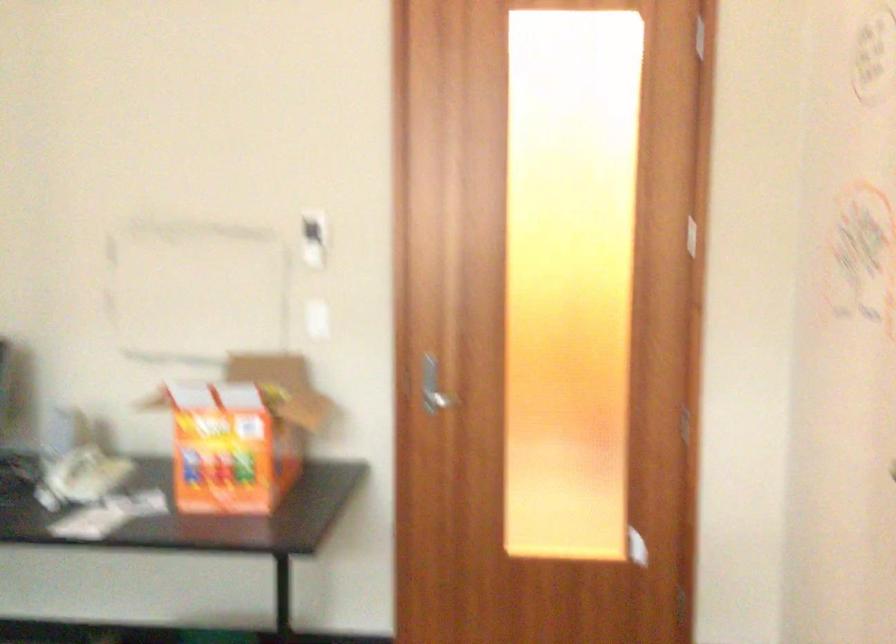
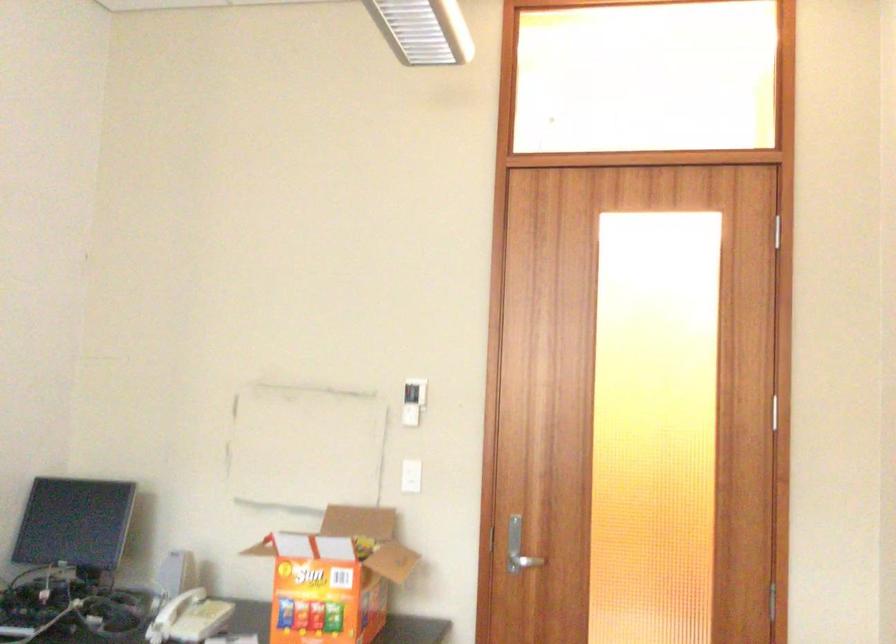
Question: Based on the continuous images, in which direction is the camera rotating? Reply with the corresponding letter.

Choices:
 (A) Left
 (B) Right
 (C) Up
 (D) Down

Answer: (C)